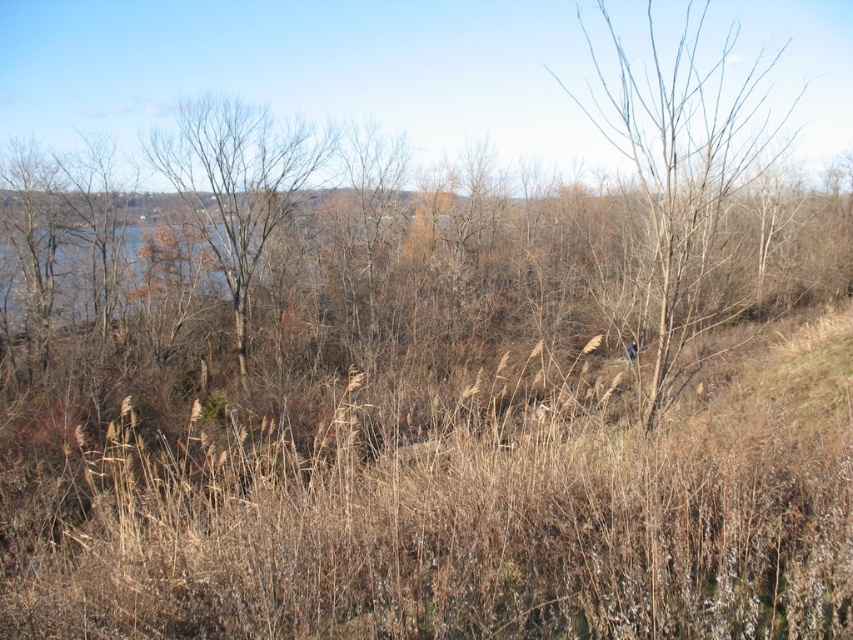
Question: Which point appears closest to the camera in this image?

Choices:
 (A) (300, 156)
 (B) (712, 257)

Answer: (B)

Question: Is bare branches at center further to camera compared to bare branches at left?

Choices:
 (A) yes
 (B) no

Answer: (B)

Question: Is bare branches at center further to the viewer compared to bare branches at left?

Choices:
 (A) yes
 (B) no

Answer: (B)

Question: Is bare branches at center below bare branches at left?

Choices:
 (A) no
 (B) yes

Answer: (A)